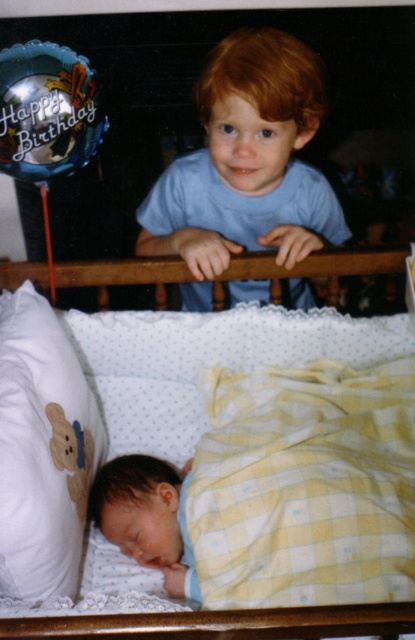
Question: Which point is farther from the camera taking this photo?

Choices:
 (A) (305, 250)
 (B) (56, 618)
 (C) (319, 568)

Answer: (A)

Question: Which object is the closest to the yellow checkered blanket at lower center?

Choices:
 (A) white soft pillow at lower left
 (B) yellow checkered blanket at center

Answer: (B)

Question: Where is blue cotton shirt at upper center located in relation to yellow checkered blanket at center in the image?

Choices:
 (A) right
 (B) left

Answer: (A)

Question: Does white soft pillow at lower left appear on the left side of yellow checkered blanket at center?

Choices:
 (A) no
 (B) yes

Answer: (B)

Question: Which object is closer to the camera taking this photo?

Choices:
 (A) blue cotton shirt at upper center
 (B) white soft pillow at lower left

Answer: (B)

Question: Is white soft pillow at lower left positioned behind yellow checkered blanket at center?

Choices:
 (A) no
 (B) yes

Answer: (A)